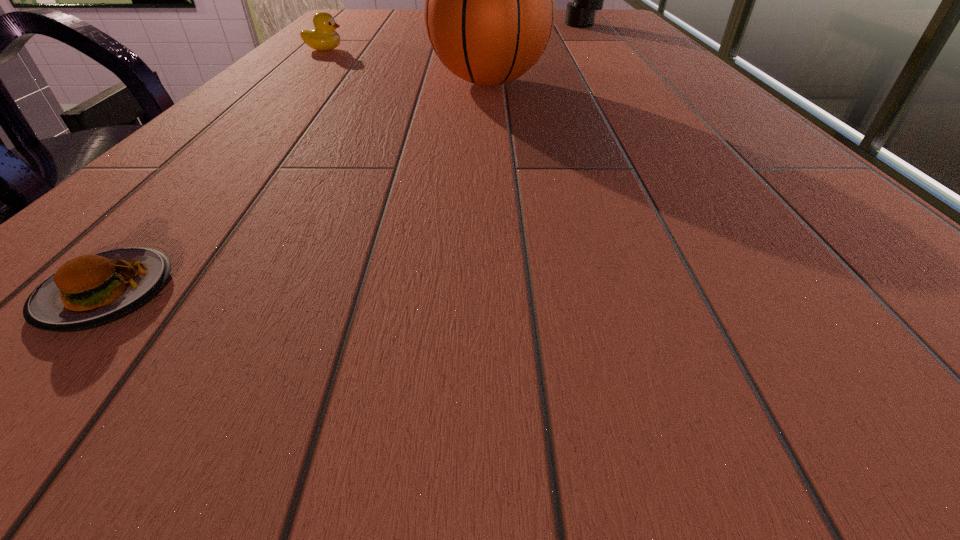
Find the location of `the second closest object relative to the nearest object`. the second closest object relative to the nearest object is located at coordinates (324, 37).

Locate an element on the screen. free space that satisfies the following two spatial constraints: 1. on the back side of the third farthest object; 2. on the beak of the second shortest object is located at coordinates (488, 50).

The width and height of the screenshot is (960, 540). Find the location of `vacant area that satisfies the following two spatial constraints: 1. on the beak of the basketball; 2. on the right side of the third nearest object`. vacant area that satisfies the following two spatial constraints: 1. on the beak of the basketball; 2. on the right side of the third nearest object is located at coordinates (292, 83).

Locate an element on the screen. The height and width of the screenshot is (540, 960). blank area in the image that satisfies the following two spatial constraints: 1. on the beak of the duckling; 2. on the left side of the second object from right to left is located at coordinates (292, 83).

Where is `vacant region that satisfies the following two spatial constraints: 1. on the beak of the third nearest object; 2. on the right side of the second object from right to left`? This screenshot has width=960, height=540. vacant region that satisfies the following two spatial constraints: 1. on the beak of the third nearest object; 2. on the right side of the second object from right to left is located at coordinates (292, 83).

What are the coordinates of `vacant space that satisfies the following two spatial constraints: 1. on the beak of the second object from right to left; 2. on the right side of the second shortest object` in the screenshot? It's located at (292, 83).